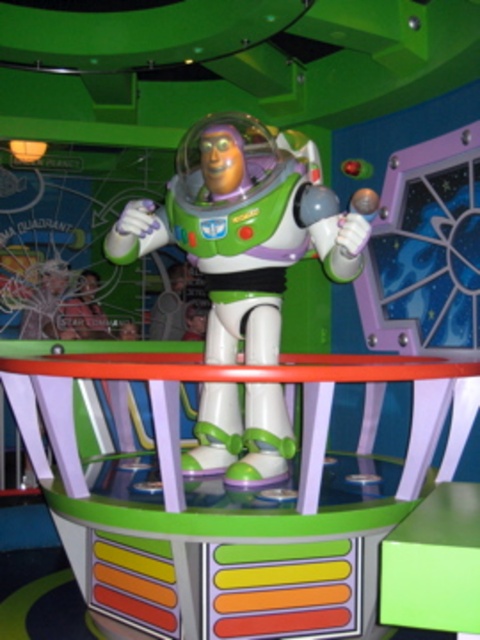
You are standing in front of the Buzz Lightyear exhibit and want to determine which of the two points, point (277, 145) or point (422, 560), is closer to you. Based on the spatial arrangement, which point is nearer?

Point (277, 145) is further to the viewer than point (422, 560). Therefore, point (422, 560) is closer to you.

You are designing a display case for a toy store and need to place the white plastic astronaut at center and the green plastic stool at center inside. The case has a width of 40 cm. If the astronaut is already placed, will the stool fit next to it without overlapping?

The white plastic astronaut at center is wider than the green plastic stool at center. Since the astronaut is already placed in the case, there might not be enough space left for the stool to fit next to it without overlapping, depending on the exact dimensions. However, since the astronaut is larger, it occupies more space, so the stool may not fit.